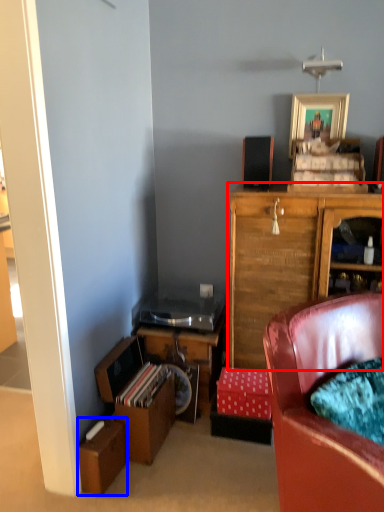
Question: Which object appears farthest to the camera in this image, cabinetry (highlighted by a red box) or cardboard box (highlighted by a blue box)?

Choices:
 (A) cabinetry
 (B) cardboard box

Answer: (A)